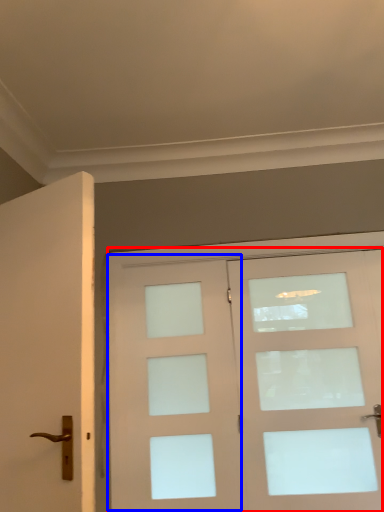
Question: Which of the following is the farthest to the observer, door (highlighted by a red box) or screen door (highlighted by a blue box)?

Choices:
 (A) door
 (B) screen door

Answer: (B)